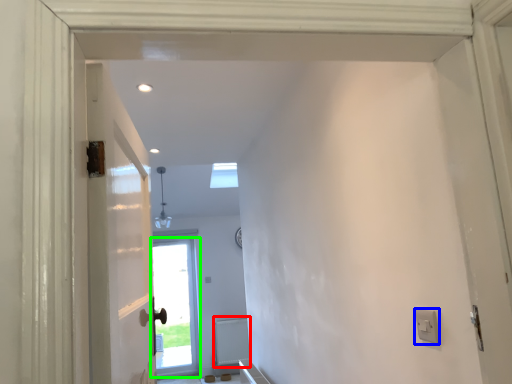
Question: Considering the real-world distances, which object is farthest from radiator (highlighted by a red box)? electric outlet (highlighted by a blue box) or door (highlighted by a green box)?

Choices:
 (A) electric outlet
 (B) door

Answer: (A)